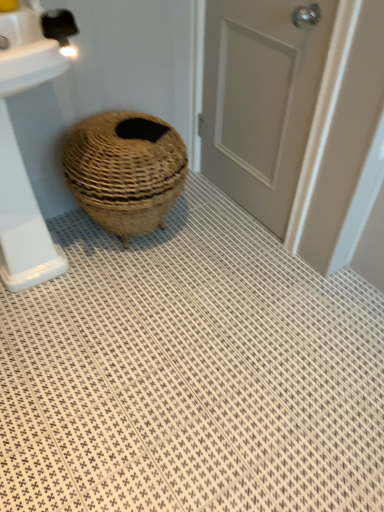
At what (x,y) coordinates should I click in order to perform the action: click on vacant region to the right of white glossy sink at left. Please return your answer as a coordinate pair (x, y). This screenshot has width=384, height=512. Looking at the image, I should click on (151, 293).